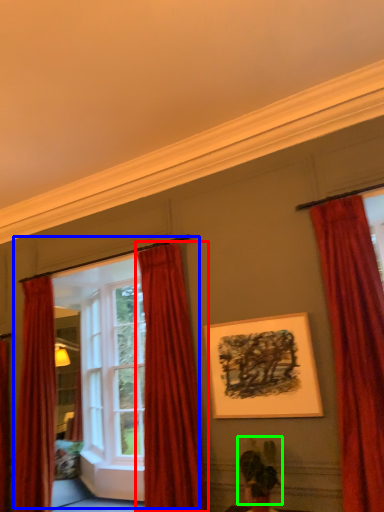
Question: Which is farther away from curtain (highlighted by a red box)? window frame (highlighted by a blue box) or plant (highlighted by a green box)?

Choices:
 (A) window frame
 (B) plant

Answer: (B)